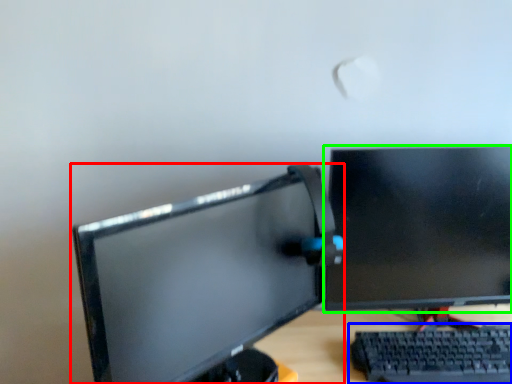
Question: Considering the real-world distances, which object is closest to computer monitor (highlighted by a red box)? computer keyboard (highlighted by a blue box) or computer monitor (highlighted by a green box).

Choices:
 (A) computer keyboard
 (B) computer monitor

Answer: (B)